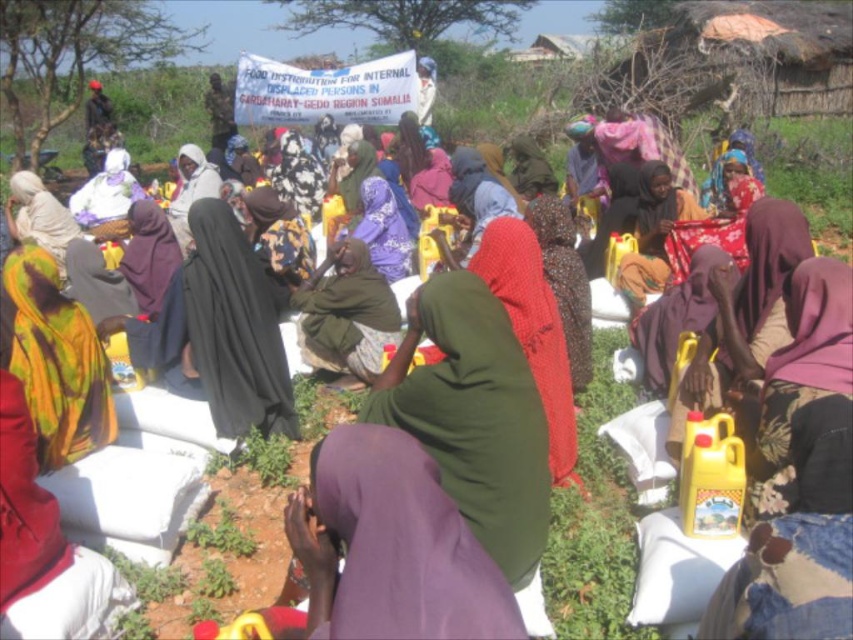
Looking at this image, is patterned fabric headscarf at center to the left of matte purple scarf at center from the viewer's perspective?

Incorrect, patterned fabric headscarf at center is not on the left side of matte purple scarf at center.

Does point (566, 291) lie in front of point (405, 236)?

That is True.

The image size is (853, 640). What do you see at coordinates (564, 280) in the screenshot?
I see `patterned fabric headscarf at center` at bounding box center [564, 280].

Identify the location of patterned fabric headscarf at center. The width and height of the screenshot is (853, 640). coord(564,280).

Does point (96, 428) come farther from viewer compared to point (360, 230)?

No, it is not.

Is printed fabric headscarf at lower left shorter than matte purple scarf at center?

In fact, printed fabric headscarf at lower left may be taller than matte purple scarf at center.

Which is behind, point (27, 266) or point (390, 221)?

The point (390, 221) is more distant.

Find the location of a particular element. Image resolution: width=853 pixels, height=640 pixels. printed fabric headscarf at lower left is located at coordinates (54, 358).

Which of these two, black matte hijab at center or dark green fabric at center, stands taller?

black matte hijab at center is taller.

Does black matte hijab at center appear on the right side of dark green fabric at center?

No, black matte hijab at center is not to the right of dark green fabric at center.

Describe the element at coordinates (235, 326) in the screenshot. This screenshot has width=853, height=640. I see `black matte hijab at center` at that location.

Locate an element on the screen. black matte hijab at center is located at coordinates (235, 326).